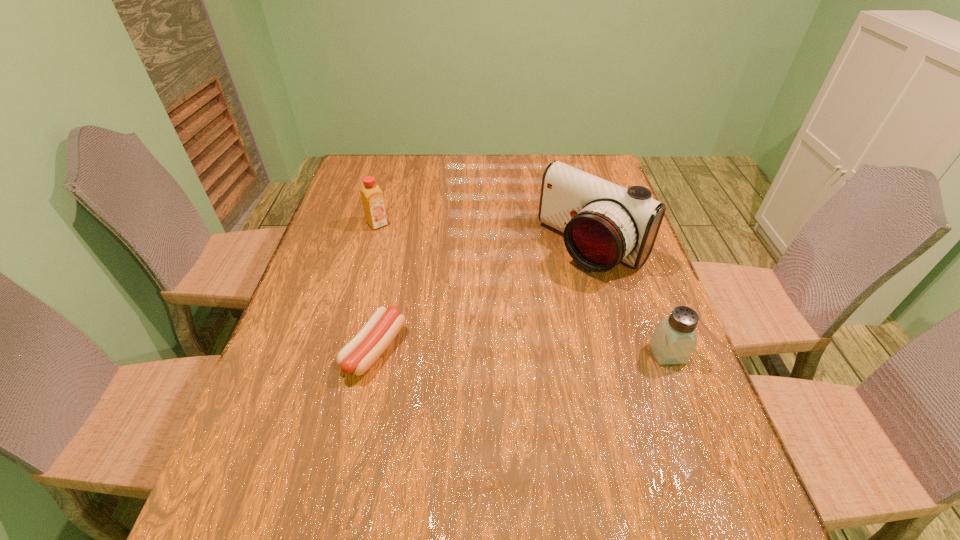
In order to click on free spot at the far right corner of the desktop in this screenshot , I will do `click(571, 154)`.

Locate an element on the screen. vacant space that is in between the saltshaker and the orange juice is located at coordinates (522, 289).

Where is `vacant area between the orange juice and the tallest object`? vacant area between the orange juice and the tallest object is located at coordinates (485, 236).

Identify the location of free point between the second shortest object and the shortest object. The width and height of the screenshot is (960, 540). (521, 351).

Where is `empty space that is in between the shortest object and the third shortest object`? empty space that is in between the shortest object and the third shortest object is located at coordinates (376, 286).

Identify the location of free space between the tallest object and the saltshaker. This screenshot has width=960, height=540. (630, 301).

Find the location of a particular element. This screenshot has height=540, width=960. free space between the orange juice and the shortest object is located at coordinates (376, 286).

Image resolution: width=960 pixels, height=540 pixels. Find the location of `free spot between the sausage and the orange juice`. free spot between the sausage and the orange juice is located at coordinates (376, 286).

Locate an element on the screen. free space between the orange juice and the second shortest object is located at coordinates (522, 289).

Locate an element on the screen. free space between the second tallest object and the tallest object is located at coordinates (485, 236).